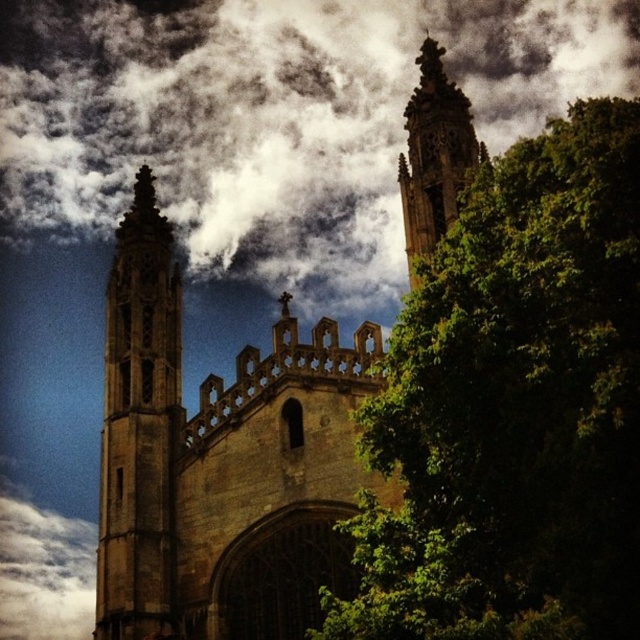
You are an architect analyzing the cathedral design. From your viewpoint, which object is closer to you between the white fluffy cloud at upper center and the brown stone tower at upper center?

The white fluffy cloud at upper center is closer because it appears in front of the brown stone tower at upper center.

You are standing at the center of a park and see the brown stone church at center in the distance. If you want to take a photo of the church with the fountain located at point 0.5, 0.5 in the frame, where should you position yourself relative to the church?

The brown stone church at center is located at coordinates (220, 461). The fountain is at (320, 320). To include both in the photo, position yourself between the two points, slightly closer to the church to ensure both are in frame.